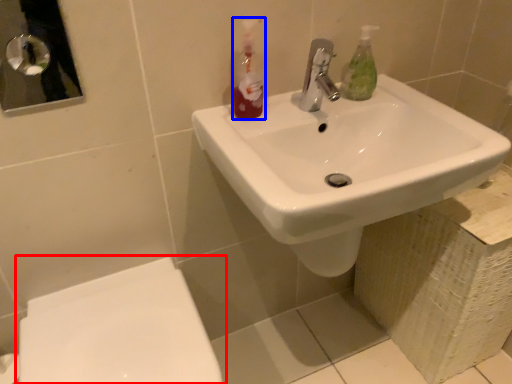
Question: Which object appears closest to the camera in this image, toilet (highlighted by a red box) or cleaning product (highlighted by a blue box)?

Choices:
 (A) toilet
 (B) cleaning product

Answer: (A)